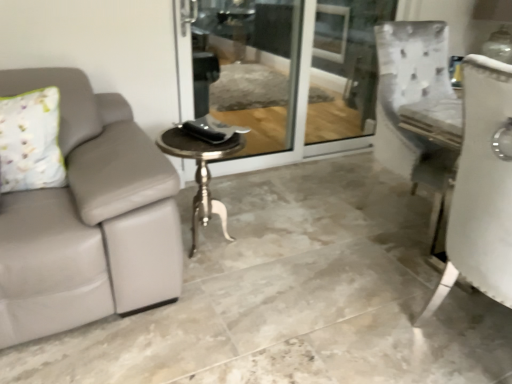
What do you see at coordinates (294, 297) in the screenshot? I see `gray leather couch at left` at bounding box center [294, 297].

Locate an element on the screen. The image size is (512, 384). polished silver table at center is located at coordinates (201, 173).

Identify the location of clear glass screen door at center. (286, 75).

Does gray leather couch at left turn towards clear glass screen door at center?

No, gray leather couch at left is not turned towards clear glass screen door at center.

From a real-world perspective, which object rests below the other?

gray leather couch at left, from a real-world perspective.

Is point (280, 190) closer or farther from the camera than point (316, 122)?

Point (280, 190).

Is gray leather couch at left positioned far away from clear glass screen door at center?

That's right, there is a large distance between gray leather couch at left and clear glass screen door at center.

Visually, is gray leather couch at left positioned to the left or to the right of polished silver table at center?

Clearly, gray leather couch at left is on the left of polished silver table at center in the image.

Which is in front, gray leather couch at left or polished silver table at center?

Positioned in front is gray leather couch at left.

From a real-world perspective, is gray leather couch at left over polished silver table at center?

Actually, gray leather couch at left is physically below polished silver table at center in the real world.

How many degrees apart are the facing directions of gray leather couch at left and polished silver table at center?

0.0551 degrees separate the facing orientations of gray leather couch at left and polished silver table at center.

Considering the sizes of objects polished silver table at center and clear glass screen door at center in the image provided, who is thinner, polished silver table at center or clear glass screen door at center?

clear glass screen door at center.

Image resolution: width=512 pixels, height=384 pixels. Find the location of `screen door behind the polished silver table at center`. screen door behind the polished silver table at center is located at coordinates (286, 75).

Choose the correct answer: Is polished silver table at center inside clear glass screen door at center or outside it?

polished silver table at center lies outside clear glass screen door at center.

From the picture: Is polished silver table at center in front of clear glass screen door at center?

Yes, polished silver table at center is closer to the viewer.

Does point (249, 99) appear closer or farther from the camera than point (298, 255)?

Point (249, 99).

How many degrees apart are the facing directions of clear glass screen door at center and gray leather couch at left?

0.0883 degrees.

You are a GUI agent. You are given a task and a screenshot of the screen. Output one action in this format:
    pyautogui.click(x=<x>, y=<y>)
    Task: Click on the screen door lying behind the gray leather couch at left
    This screenshot has height=384, width=512.
    Given the screenshot: What is the action you would take?
    pyautogui.click(x=286, y=75)

Which object is thinner, clear glass screen door at center or floral fabric pillow at left?

Thinner between the two is clear glass screen door at center.

Based on the photo, between clear glass screen door at center and floral fabric pillow at left, which one has smaller size?

floral fabric pillow at left is smaller.

Could you tell me if clear glass screen door at center is facing floral fabric pillow at left?

No, clear glass screen door at center is not facing towards floral fabric pillow at left.

Does floral fabric pillow at left have a larger size compared to gray leather couch at left?

No, floral fabric pillow at left is not bigger than gray leather couch at left.

Does floral fabric pillow at left have a greater height compared to gray leather couch at left?

Indeed, floral fabric pillow at left has a greater height compared to gray leather couch at left.

From the picture: Does floral fabric pillow at left have a lesser width compared to gray leather couch at left?

Yes, floral fabric pillow at left is thinner than gray leather couch at left.

From the image's perspective, who appears lower, floral fabric pillow at left or gray leather couch at left?

floral fabric pillow at left.

Locate an element on the screen. pillow positioned vertically above the clear glass screen door at center (from a real-world perspective) is located at coordinates 30,141.

Between floral fabric pillow at left and clear glass screen door at center, which one has smaller size?

Smaller between the two is floral fabric pillow at left.

Which is correct: floral fabric pillow at left is inside clear glass screen door at center, or outside of it?

floral fabric pillow at left lies outside clear glass screen door at center.

This screenshot has width=512, height=384. I want to click on concrete directly beneath the clear glass screen door at center (from a real-world perspective), so click(294, 297).

Locate an element on the screen. Image resolution: width=512 pixels, height=384 pixels. concrete above the polished silver table at center (from the image's perspective) is located at coordinates (294, 297).

Based on their spatial positions, is clear glass screen door at center or floral fabric pillow at left further from gray leather couch at left?

clear glass screen door at center is positioned further to the anchor gray leather couch at left.

Based on their spatial positions, is gray leather couch at left or floral fabric pillow at left further from polished silver table at center?

floral fabric pillow at left lies further to polished silver table at center than the other object.

Which object lies nearer to the anchor point floral fabric pillow at left, gray leather couch at left or polished silver table at center?

Among the two, polished silver table at center is located nearer to floral fabric pillow at left.

Estimate the real-world distances between objects in this image. Which object is closer to polished silver table at center, floral fabric pillow at left or gray leather couch at left?

Based on the image, gray leather couch at left appears to be nearer to polished silver table at center.

Considering their positions, is polished silver table at center positioned closer to clear glass screen door at center than floral fabric pillow at left?

Among the two, polished silver table at center is located nearer to clear glass screen door at center.

When comparing their distances from gray leather couch at left, does floral fabric pillow at left or polished silver table at center seem further?

floral fabric pillow at left.

Considering their positions, is gray leather couch at left positioned closer to clear glass screen door at center than polished silver table at center?

Among the two, gray leather couch at left is located nearer to clear glass screen door at center.

Looking at the image, which one is located further to polished silver table at center, gray leather couch at left or clear glass screen door at center?

Among the two, clear glass screen door at center is located further to polished silver table at center.

Locate an element on the screen. The height and width of the screenshot is (384, 512). pillow between gray leather couch at left and clear glass screen door at center along the z-axis is located at coordinates (30, 141).

This screenshot has width=512, height=384. I want to click on pillow between gray leather couch at left and polished silver table at center vertically, so click(x=30, y=141).

The width and height of the screenshot is (512, 384). What are the coordinates of `table located between gray leather couch at left and clear glass screen door at center in the depth direction` in the screenshot? It's located at (201, 173).

Locate an element on the screen. table between floral fabric pillow at left and clear glass screen door at center in the horizontal direction is located at coordinates (201, 173).